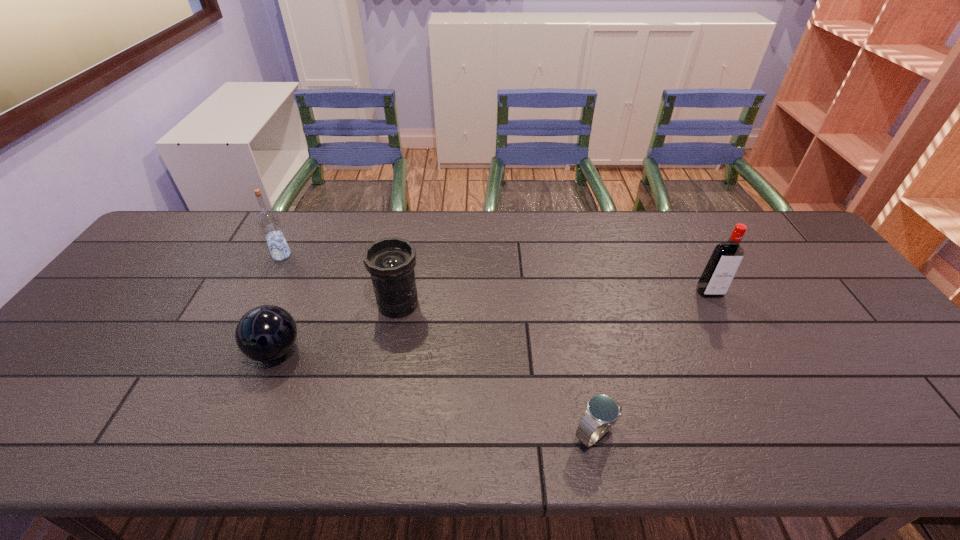
The height and width of the screenshot is (540, 960). Identify the location of empty space that is in between the farthest object and the second object from right to left. (439, 345).

Identify the location of free point between the nearer vodka and the second object from right to left. This screenshot has width=960, height=540. (652, 363).

Find the location of a particular element. This screenshot has width=960, height=540. vacant point located between the leftmost object and the second object from right to left is located at coordinates (439, 345).

Find the location of a particular element. the second closest object to the second object from left to right is located at coordinates (268, 220).

Identify which object is the fourth closest to the watch. Please provide its 2D coordinates. Your answer should be formatted as a tuple, i.e. [(x, y)], where the tuple contains the x and y coordinates of a point satisfying the conditions above.

[(268, 220)]

What are the coordinates of `vacant space that satisfies the following two spatial constraints: 1. on the side of the fourth tallest object with the finger holes; 2. on the right side of the second object from right to left` in the screenshot? It's located at (241, 434).